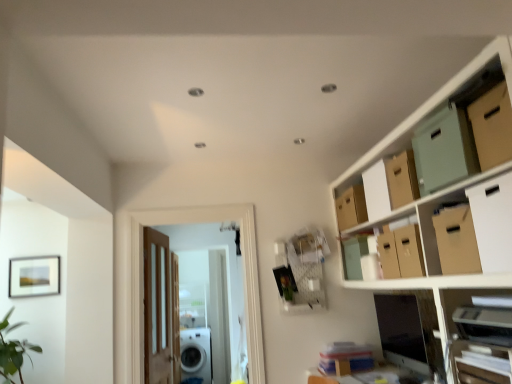
Question: From the image's perspective, is white cardboard box at upper right, which is the fourth cardboard box from back to front, above or below wooden door at center, which appears as the first door when viewed from the right?

Choices:
 (A) above
 (B) below

Answer: (A)

Question: Choose the correct answer: Is white cardboard box at upper right, which appears as the first cardboard box when viewed from the front, inside wooden door at center, which is the 1th door in front-to-back order, or outside it?

Choices:
 (A) outside
 (B) inside

Answer: (A)

Question: Which object is the closest to the brown cardboard box at upper right, which is counted as the 4th cardboard box, starting from the front?

Choices:
 (A) matte black picture frame at upper left
 (B) brown cardboard box at upper right, positioned as the second cardboard box in back-to-front order
 (C) wooden door at center, which is counted as the 2th door, starting from the back
 (D) brown cardboard box at upper right, the third cardboard box in the back-to-front sequence
 (E) white glossy washing machine at lower center

Answer: (B)

Question: Based on their relative distances, which object is nearer to the white cardboard box at upper right, which appears as the first cardboard box when viewed from the front?

Choices:
 (A) wooden door at center, which appears as the first door when viewed from the right
 (B) mint green cardboard storage box at upper right, the 1th storage box when ordered from front to back
 (C) brown cardboard box at upper right, marked as the second cardboard box in a front-to-back arrangement
 (D) matte cardboard boxes at upper right
 (E) brown cardboard box at upper right, the 3th cardboard box when ordered from front to back

Answer: (E)